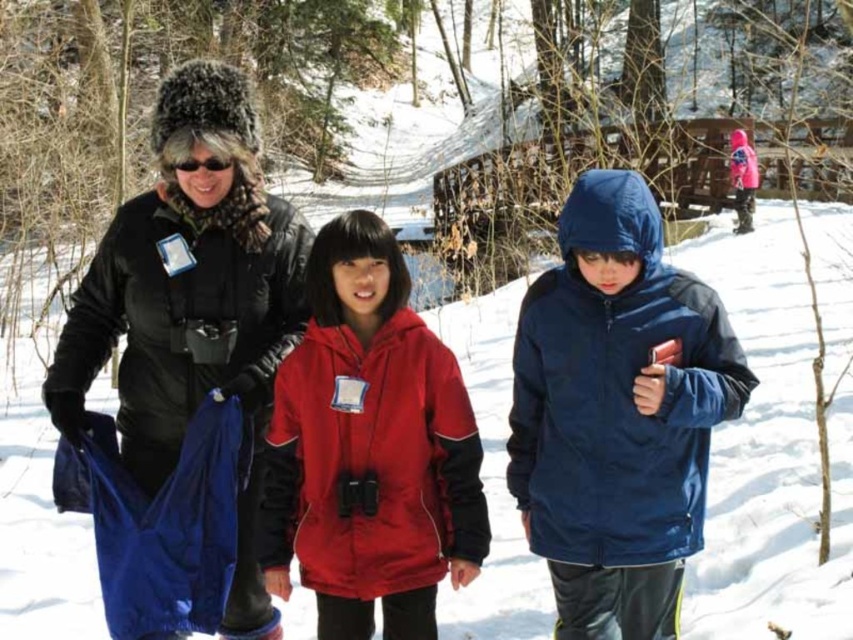
You are taking a photo of the two points in the winter scene. Which point, point (189, 260) or point (451, 509), will appear larger in your photo?

Point (189, 260) is further to the camera than point (451, 509), so it will appear larger in the photo.

You are standing at point A located at coordinates point (189, 138) and want to walk to point B located at coordinates point (535, 484). Considering the snowy terrain, will you be able to see point B from your current position?

Point (535, 484) is behind point (189, 138), so you will not be able to see point B from your current position at point A.